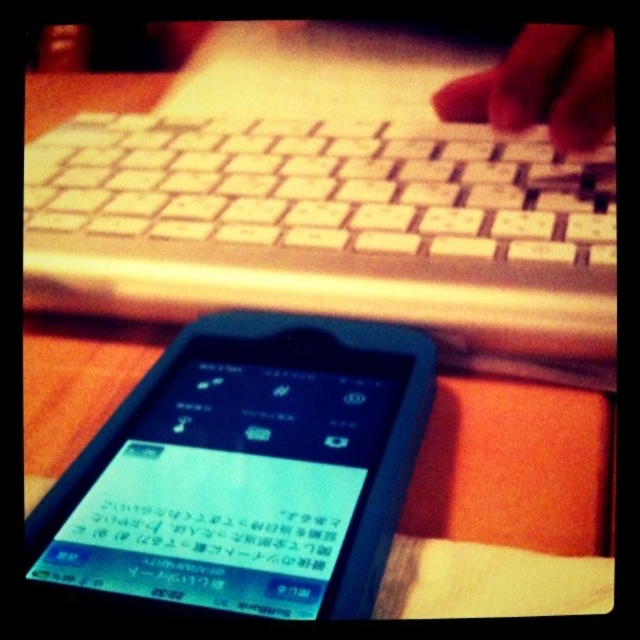
Is point (100, 550) positioned before point (554, 112)?

Yes, it is.

Who is more forward, (148, 508) or (573, 45)?

Point (148, 508) is in front.

In order to click on blue plastic phone at lower center in this screenshot , I will do `click(209, 532)`.

Does white plastic keyboard at upper center have a lesser width compared to smooth skin hand at upper right?

Incorrect, white plastic keyboard at upper center's width is not less than smooth skin hand at upper right's.

Is white plastic keyboard at upper center above smooth skin hand at upper right?

Answer: Incorrect, white plastic keyboard at upper center is not positioned above smooth skin hand at upper right.

Describe the element at coordinates (321, 188) in the screenshot. The width and height of the screenshot is (640, 640). I see `white plastic keyboard at upper center` at that location.

Where is `white plastic keyboard at upper center`? This screenshot has width=640, height=640. white plastic keyboard at upper center is located at coordinates (321, 188).

Is black matte smartphone at lower center shorter than white plastic keyboard at upper center?

Indeed, black matte smartphone at lower center has a lesser height compared to white plastic keyboard at upper center.

Where is `black matte smartphone at lower center`? The width and height of the screenshot is (640, 640). black matte smartphone at lower center is located at coordinates (244, 472).

Where is `black matte smartphone at lower center`? The height and width of the screenshot is (640, 640). black matte smartphone at lower center is located at coordinates (244, 472).